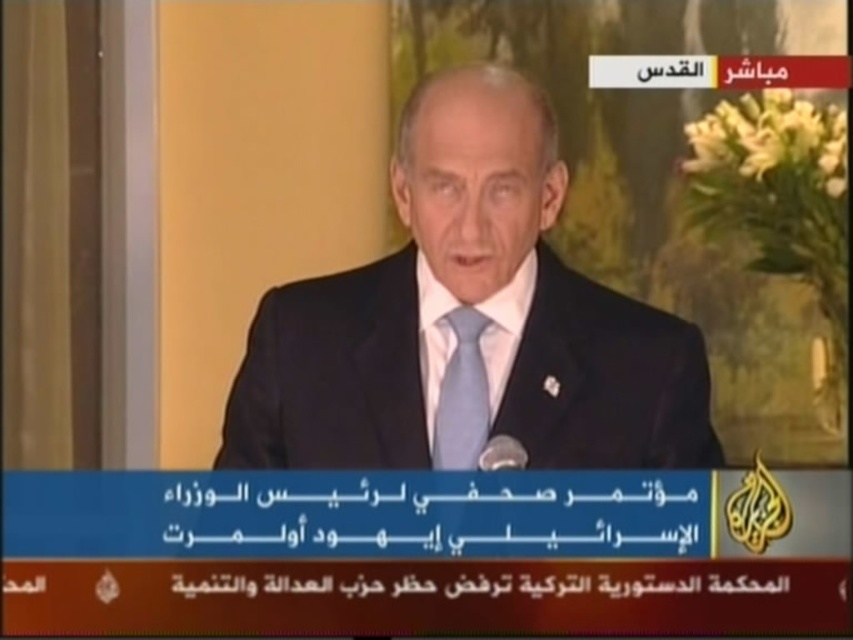
Question: Which point is farther to the camera?

Choices:
 (A) light blue silk tie at center
 (B) dark blue suit at center

Answer: (A)

Question: Is dark blue suit at center above light blue silk tie at center?

Choices:
 (A) yes
 (B) no

Answer: (A)

Question: Is dark blue suit at center smaller than light blue silk tie at center?

Choices:
 (A) yes
 (B) no

Answer: (B)

Question: Among these objects, which one is nearest to the camera?

Choices:
 (A) dark blue suit at center
 (B) light blue silk tie at center

Answer: (A)

Question: Is dark blue suit at center behind light blue silk tie at center?

Choices:
 (A) no
 (B) yes

Answer: (A)